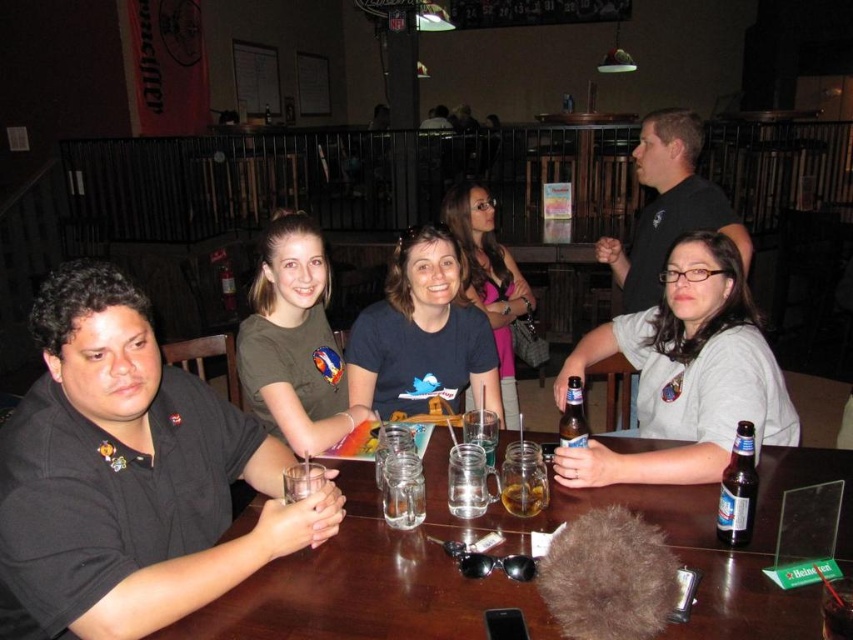
Measure the distance from matte blue shirt at center to dark brown glass bottle at table right.

36.78 inches

Which is in front, point (358, 355) or point (727, 470)?

Point (727, 470)

You are a GUI agent. You are given a task and a screenshot of the screen. Output one action in this format:
    pyautogui.click(x=<x>, y=<y>)
    Task: Click on the matte blue shirt at center
    This screenshot has height=640, width=853.
    Given the screenshot: What is the action you would take?
    pyautogui.click(x=422, y=333)

Is matte blue shirt at center to the left of translucent glass mug at table center from the viewer's perspective?

Yes, matte blue shirt at center is to the left of translucent glass mug at table center.

Who is more distant from viewer, (421, 365) or (529, 476)?

The point (421, 365) is more distant.

Identify the location of matte blue shirt at center. (422, 333).

Where is `matte blue shirt at center`? The image size is (853, 640). matte blue shirt at center is located at coordinates (422, 333).

Image resolution: width=853 pixels, height=640 pixels. What do you see at coordinates (685, 374) in the screenshot?
I see `gray cotton shirt at center` at bounding box center [685, 374].

Does gray cotton shirt at center have a lesser width compared to gray matte shirt at center?

Incorrect, gray cotton shirt at center's width is not less than gray matte shirt at center's.

You are a GUI agent. You are given a task and a screenshot of the screen. Output one action in this format:
    pyautogui.click(x=<x>, y=<y>)
    Task: Click on the gray cotton shirt at center
    
    Given the screenshot: What is the action you would take?
    pyautogui.click(x=685, y=374)